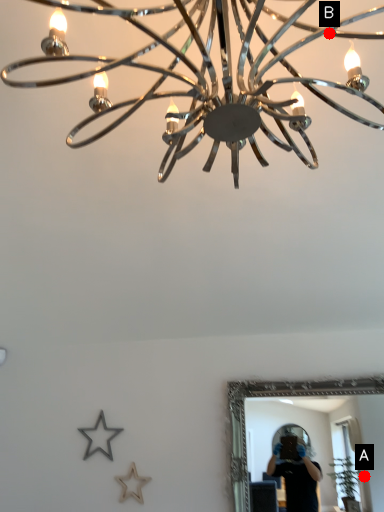
Question: Two points are circled on the image, labeled by A and B beside each circle. Which point is closer to the camera?

Choices:
 (A) A is closer
 (B) B is closer

Answer: (B)